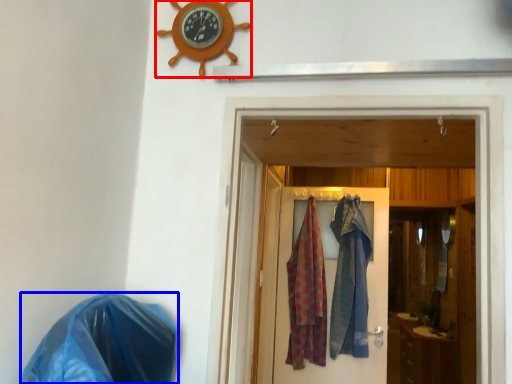
Question: Which object appears farthest to the camera in this image, clock (highlighted by a red box) or material (highlighted by a blue box)?

Choices:
 (A) clock
 (B) material

Answer: (A)